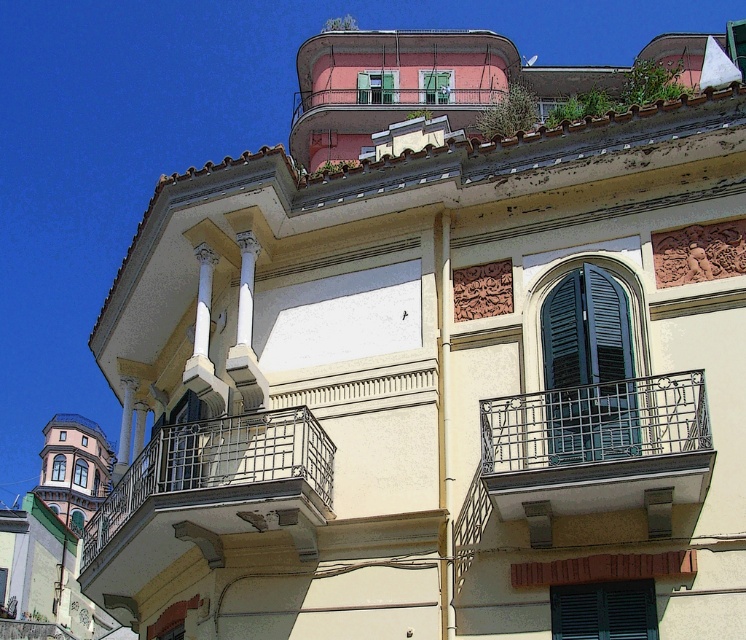
Question: Does silver metallic balcony at center appear under green matte shutter at lower center?

Choices:
 (A) yes
 (B) no

Answer: (B)

Question: Does silver metallic balcony at center come behind green matte shutters at center?

Choices:
 (A) no
 (B) yes

Answer: (B)

Question: Which object is farther from the camera taking this photo?

Choices:
 (A) green matte shutters at center
 (B) silver metallic balcony at center
 (C) green matte shutter at lower center

Answer: (B)

Question: Considering the real-world distances, which object is closest to the green matte shutter at lower center?

Choices:
 (A) black wrought iron balcony at center
 (B) green matte shutters at center
 (C) silver metallic balcony at center

Answer: (B)

Question: Does black wrought iron balcony at center appear on the right side of green matte shutter at lower center?

Choices:
 (A) yes
 (B) no

Answer: (B)

Question: Which point is farther to the camera?

Choices:
 (A) (645, 596)
 (B) (104, 560)

Answer: (B)